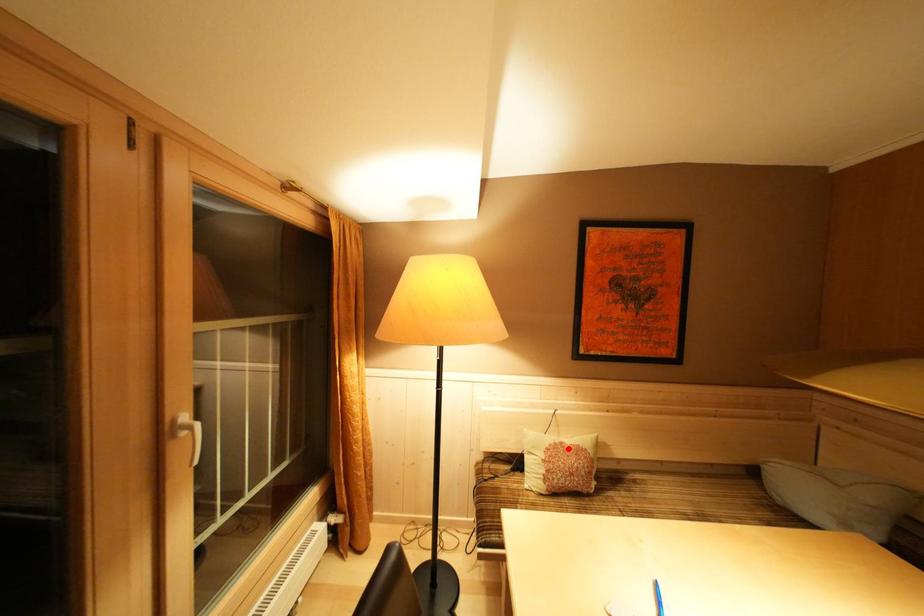
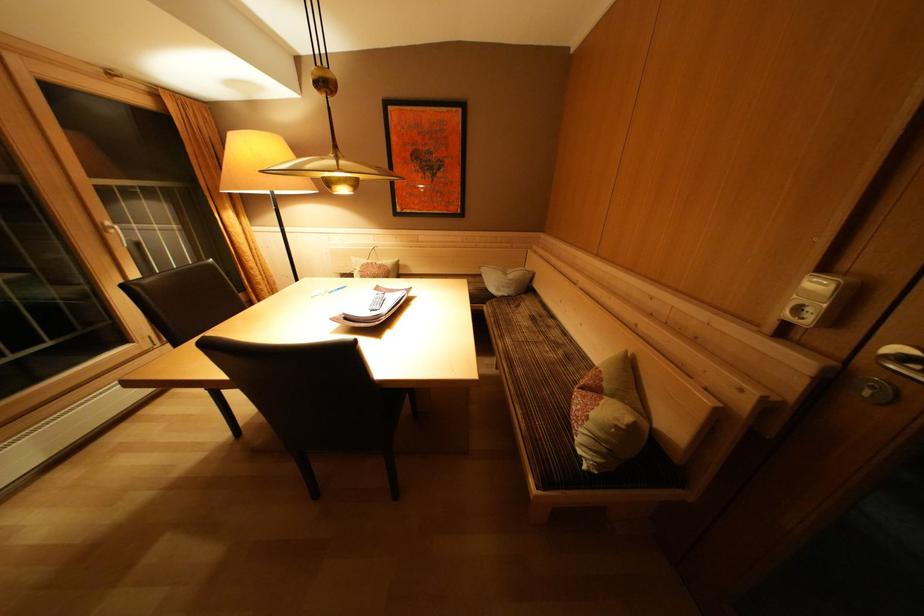
Where in the second image is the point corresponding to the highlighted location from the first image?

(379, 268)